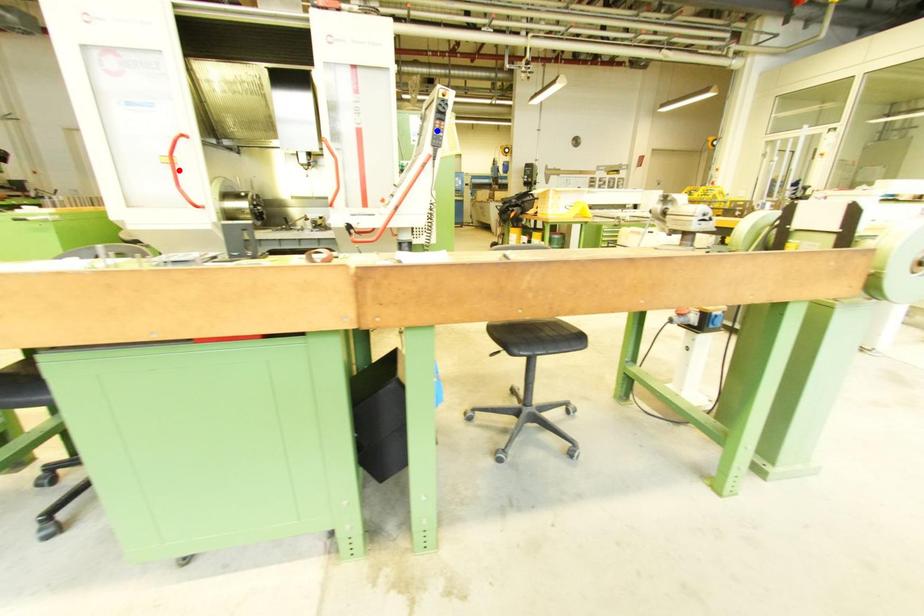
Question: In the image, two points are highlighted. Which point is nearer to the camera? Reply with the corresponding letter.

Choices:
 (A) blue point
 (B) red point

Answer: (A)